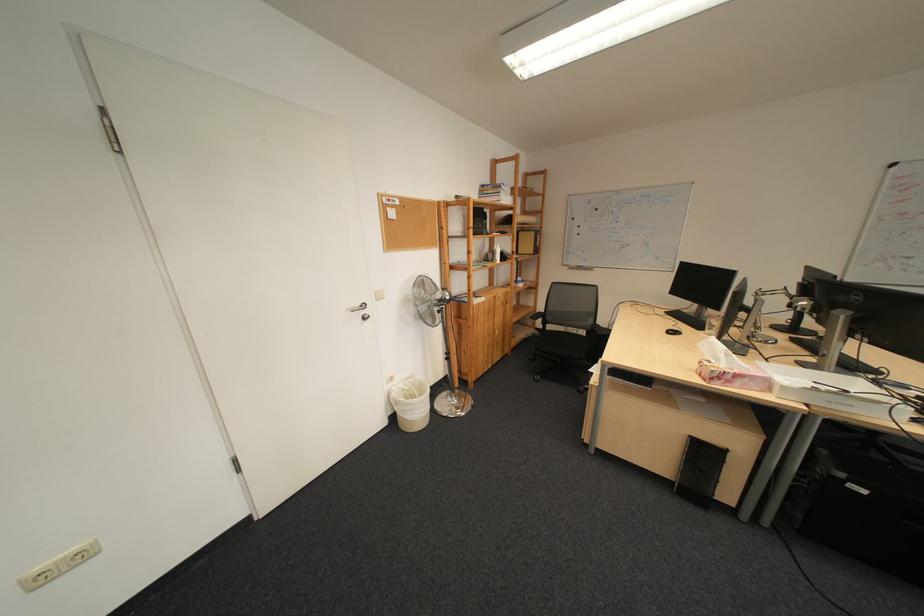
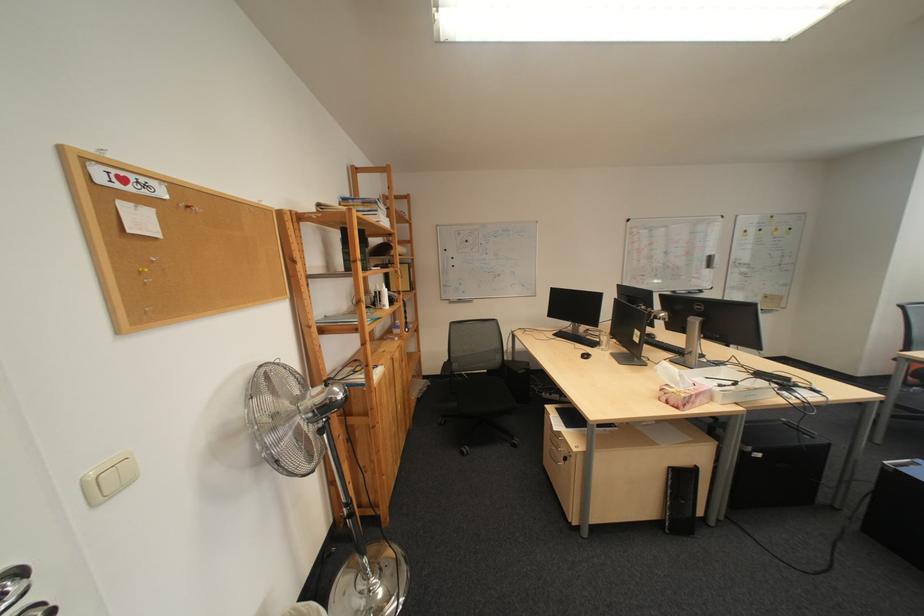
The point at (732,361) is marked in the first image. Where is the corresponding point in the second image?

(690, 385)